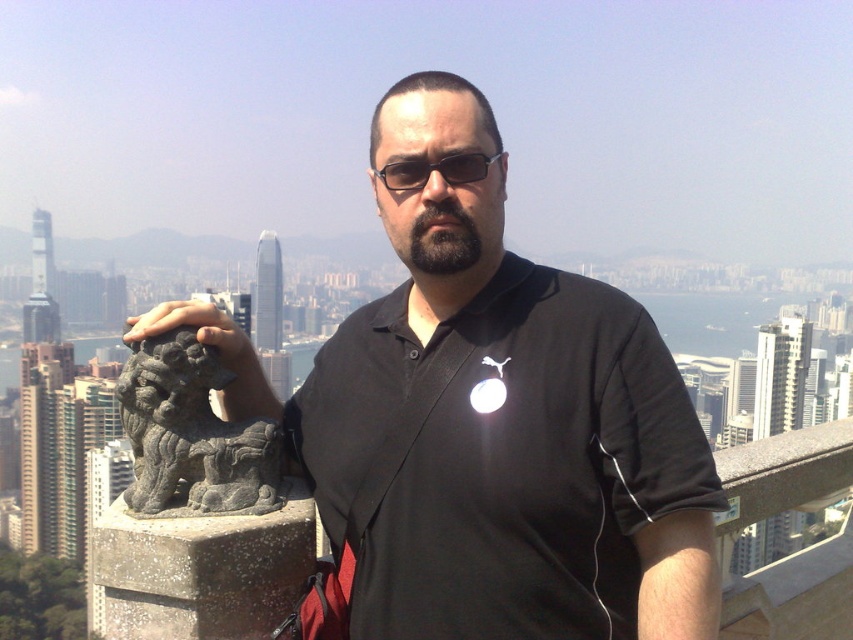
Question: Estimate the real-world distances between objects in this image. Which object is closer to the black matte shirt at center?

Choices:
 (A) sunglasses at center
 (B) gray stone lion at left

Answer: (B)

Question: Is black matte shirt at center further to the viewer compared to gray stone lion at left?

Choices:
 (A) no
 (B) yes

Answer: (A)

Question: Is gray stone lion at left to the left of sunglasses at center from the viewer's perspective?

Choices:
 (A) yes
 (B) no

Answer: (A)

Question: Which point is closer to the camera?

Choices:
 (A) black matte shirt at center
 (B) sunglasses at center

Answer: (A)

Question: Which point appears farthest from the camera in this image?

Choices:
 (A) 403,173
 (B) 387,161

Answer: (B)

Question: Does black matte shirt at center appear over sunglasses at center?

Choices:
 (A) yes
 (B) no

Answer: (B)